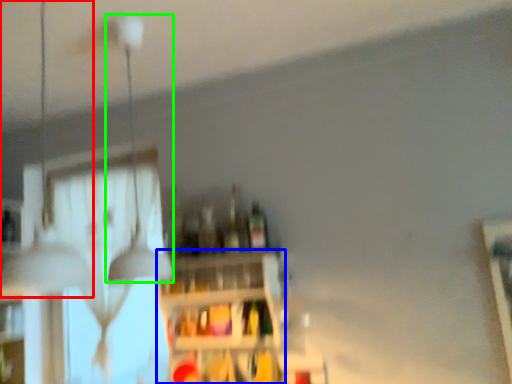
Question: Which object is positioned farthest from lamp (highlighted by a red box)? Select from shelf (highlighted by a blue box) and lamp (highlighted by a green box).

Choices:
 (A) shelf
 (B) lamp

Answer: (B)